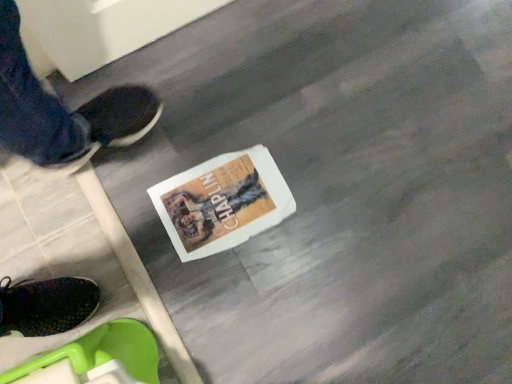
Image resolution: width=512 pixels, height=384 pixels. I want to click on space that is in front of white paper magazine at center, so (215, 290).